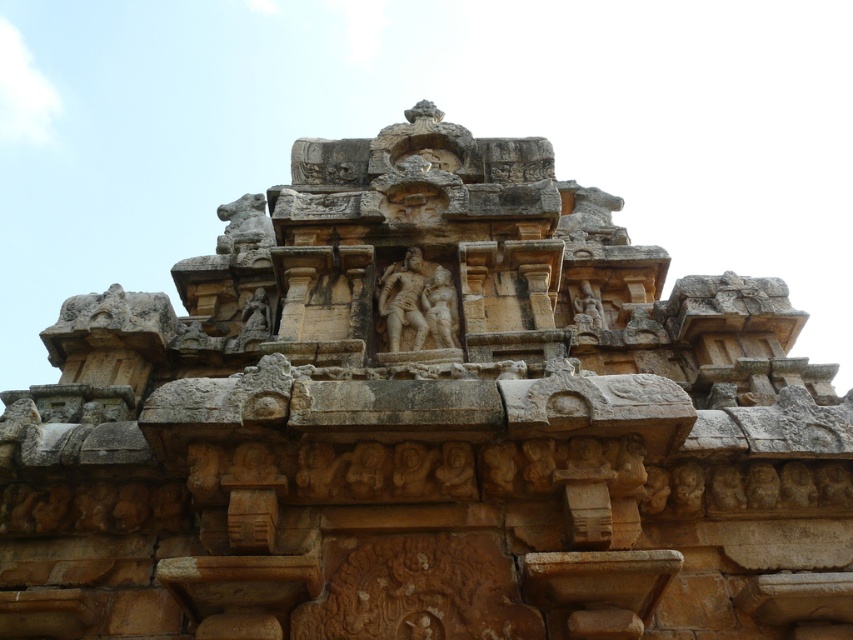
Question: Which object appears closest to the camera in this image?

Choices:
 (A) carved stone statue at upper right
 (B) stone carved sculpture at center

Answer: (B)

Question: Does stone carved sculpture at center have a larger size compared to carved stone statue at upper right?

Choices:
 (A) yes
 (B) no

Answer: (A)

Question: Among these points, which one is nearest to the camera?

Choices:
 (A) (381, 310)
 (B) (592, 320)

Answer: (A)

Question: Can you confirm if stone carved sculpture at center is positioned below carved stone statue at upper right?

Choices:
 (A) yes
 (B) no

Answer: (A)

Question: Can you confirm if stone carved sculpture at center is positioned above carved stone statue at upper right?

Choices:
 (A) yes
 (B) no

Answer: (B)